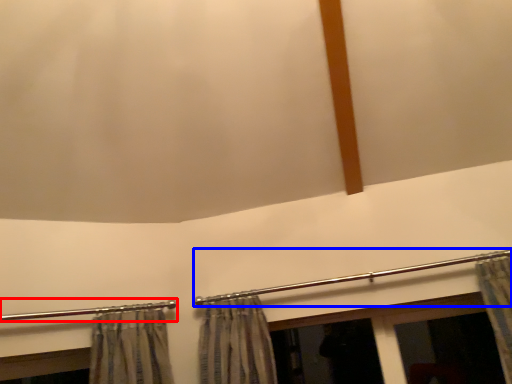
Question: Among these objects, which one is farthest to the camera, clothesline (highlighted by a red box) or clothesline (highlighted by a blue box)?

Choices:
 (A) clothesline
 (B) clothesline

Answer: (B)